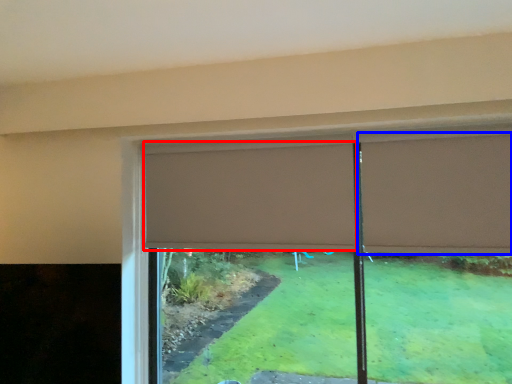
Question: Among these objects, which one is nearest to the camera, curtain (highlighted by a red box) or curtain (highlighted by a blue box)?

Choices:
 (A) curtain
 (B) curtain

Answer: (B)